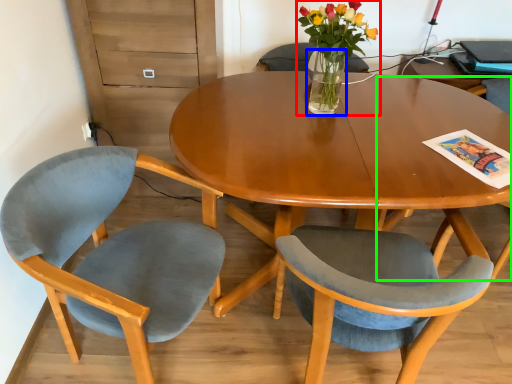
Question: Which object is the farthest from houseplant (highlighted by a red box)? Choose among these: vase (highlighted by a blue box) or chair (highlighted by a green box).

Choices:
 (A) vase
 (B) chair

Answer: (B)